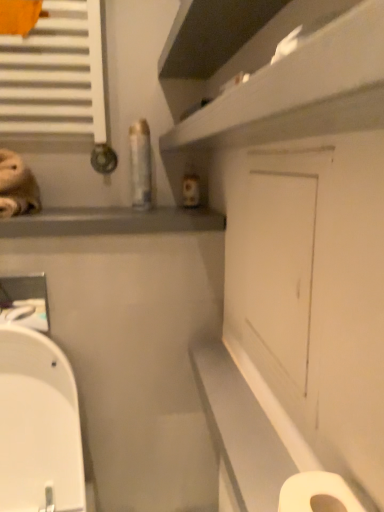
Question: Is white matte toilet paper at lower right spatially inside matte gray window sill at upper left, or outside of it?

Choices:
 (A) inside
 (B) outside

Answer: (B)

Question: From the image's perspective, is white matte toilet paper at lower right located above or below matte gray window sill at upper left?

Choices:
 (A) above
 (B) below

Answer: (B)

Question: Considering the real-world distances, which object is closest to the white matte door at center?

Choices:
 (A) matte gray window sill at upper left
 (B) white glossy shelf at upper center
 (C) white matte toilet paper at lower right
 (D) white glossy toilet at lower left

Answer: (B)

Question: Which object is positioned closest to the matte gray window sill at upper left?

Choices:
 (A) white glossy toilet at lower left
 (B) white matte door at center
 (C) white matte toilet paper at lower right
 (D) white glossy shelf at upper center

Answer: (B)